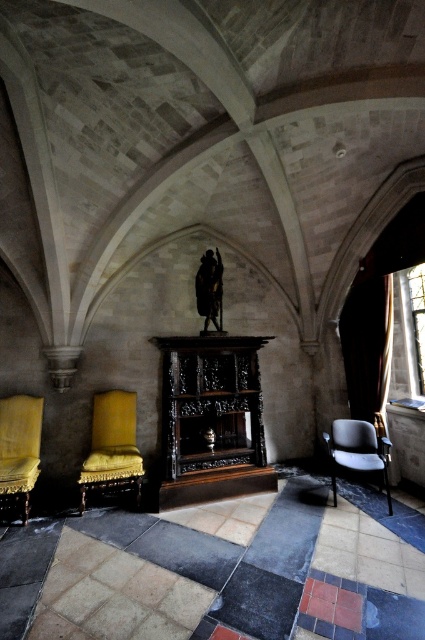
Question: Can you confirm if velvet yellow armchair at left is wider than gold fabric armchair at left?

Choices:
 (A) yes
 (B) no

Answer: (A)

Question: Does gold fabric armchair at left come behind matte black armchair at lower right?

Choices:
 (A) yes
 (B) no

Answer: (B)

Question: Does gold fabric armchair at left lie in front of matte black armchair at lower right?

Choices:
 (A) yes
 (B) no

Answer: (A)

Question: Which of the following is the closest to the observer?

Choices:
 (A) gold fabric armchair at left
 (B) matte black armchair at lower right

Answer: (A)

Question: Which of the following is the closest to the observer?

Choices:
 (A) (136, 397)
 (B) (19, 458)

Answer: (B)

Question: Which object is the farthest from the gold fabric armchair at left?

Choices:
 (A) velvet yellow armchair at left
 (B) matte black armchair at lower right

Answer: (B)